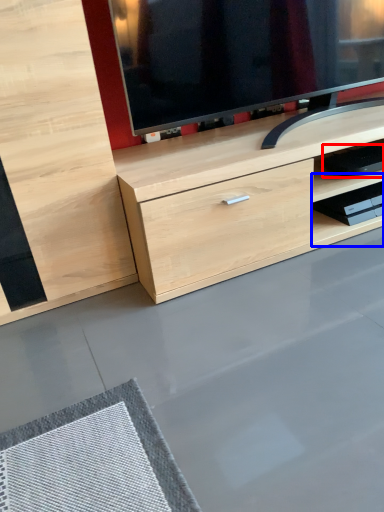
Question: Among these objects, which one is farthest to the camera, equipment (highlighted by a red box) or shelf (highlighted by a blue box)?

Choices:
 (A) equipment
 (B) shelf

Answer: (B)